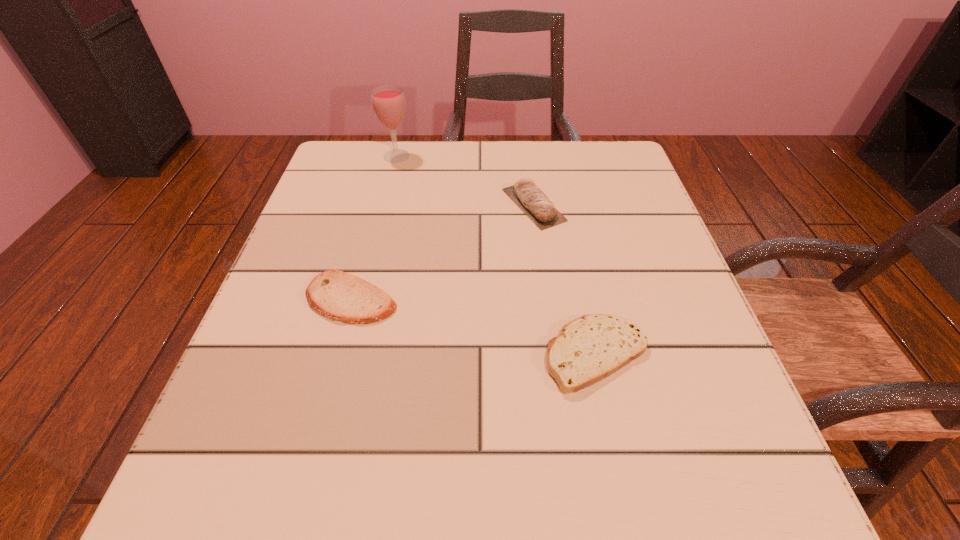
Where is `blank area in the image that satisfies the following two spatial constraints: 1. on the back side of the leftmost pita bread; 2. on the left side of the tallest object`? blank area in the image that satisfies the following two spatial constraints: 1. on the back side of the leftmost pita bread; 2. on the left side of the tallest object is located at coordinates (390, 156).